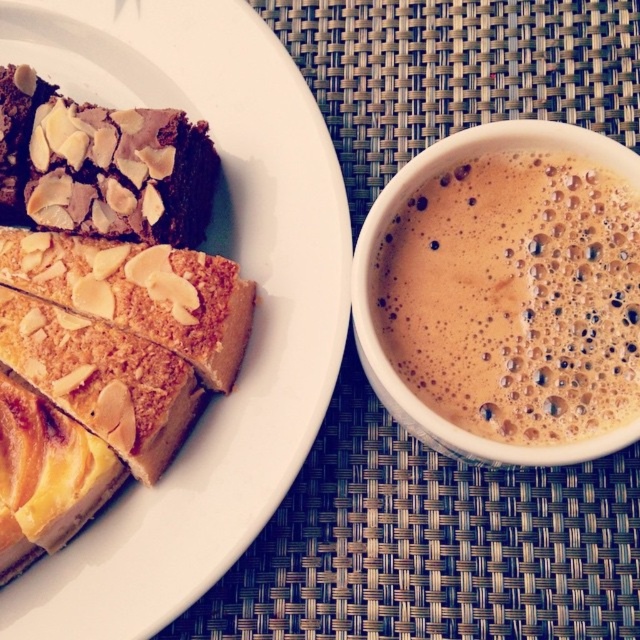
Question: Which point is farther to the camera?

Choices:
 (A) golden crumbly slice at upper left
 (B) brown matte cake at left
 (C) brown frothy coffee at right
 (D) dark brown cake with almond slices at upper left

Answer: (D)

Question: Is brown frothy coffee at right positioned behind dark brown cake with almond slices at upper left?

Choices:
 (A) no
 (B) yes

Answer: (A)

Question: Among these objects, which one is farthest from the camera?

Choices:
 (A) brown matte cake at left
 (B) dark brown cake with almond slices at upper left
 (C) brown frothy coffee at right

Answer: (B)

Question: Which object is positioned farthest from the brown frothy coffee at right?

Choices:
 (A) brown matte cake at left
 (B) dark brown cake with almond slices at upper left
 (C) golden crumbly slice at upper left

Answer: (B)

Question: Is brown matte cake at left positioned at the back of dark brown cake with almond slices at upper left?

Choices:
 (A) yes
 (B) no

Answer: (B)

Question: Does brown matte cake at left have a smaller size compared to dark brown cake with almond slices at upper left?

Choices:
 (A) no
 (B) yes

Answer: (A)